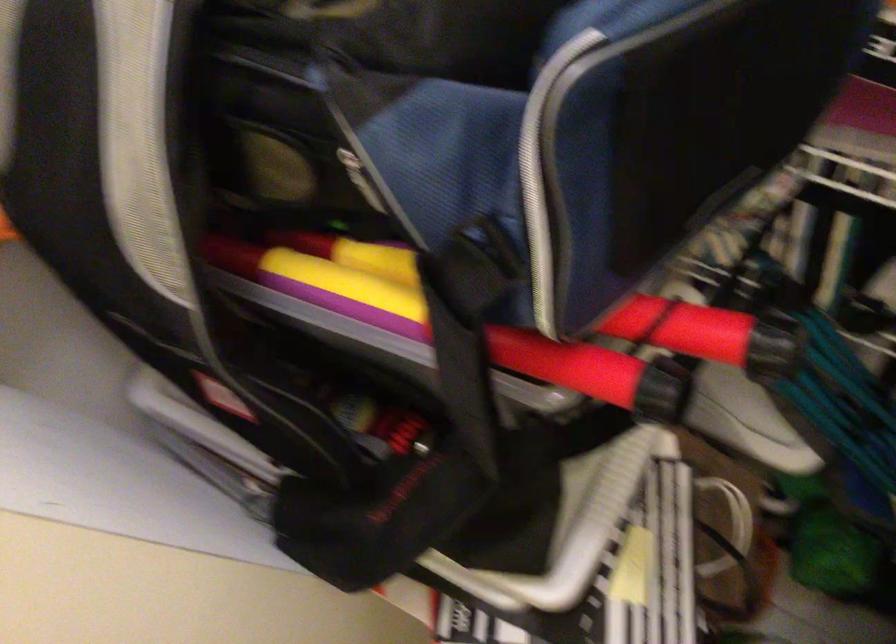
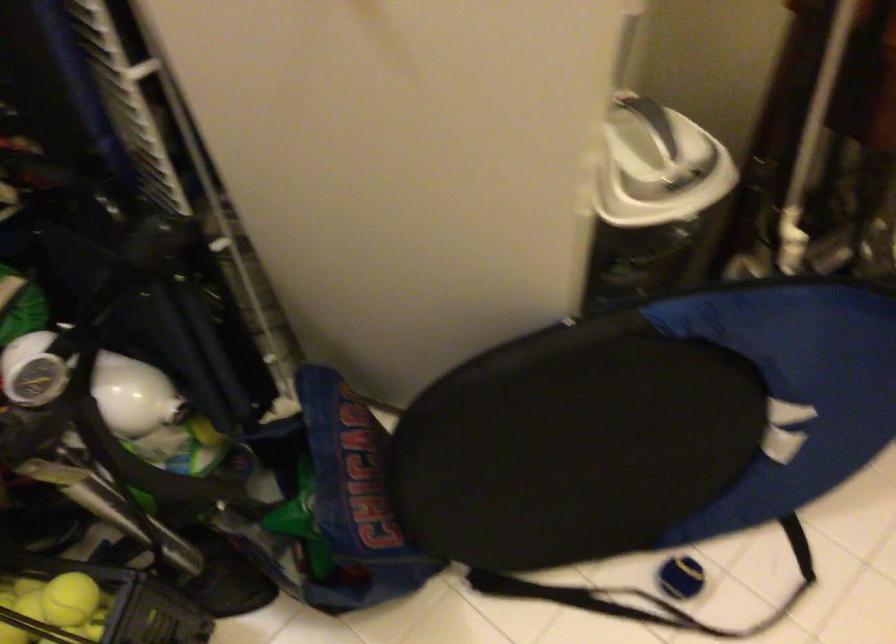
Question: The camera is either moving clockwise (left) or counter-clockwise (right) around the object. The first image is from the beginning of the video and the second image is from the end. Is the camera moving left or right when shooting the video?

Choices:
 (A) Left
 (B) Right

Answer: (A)